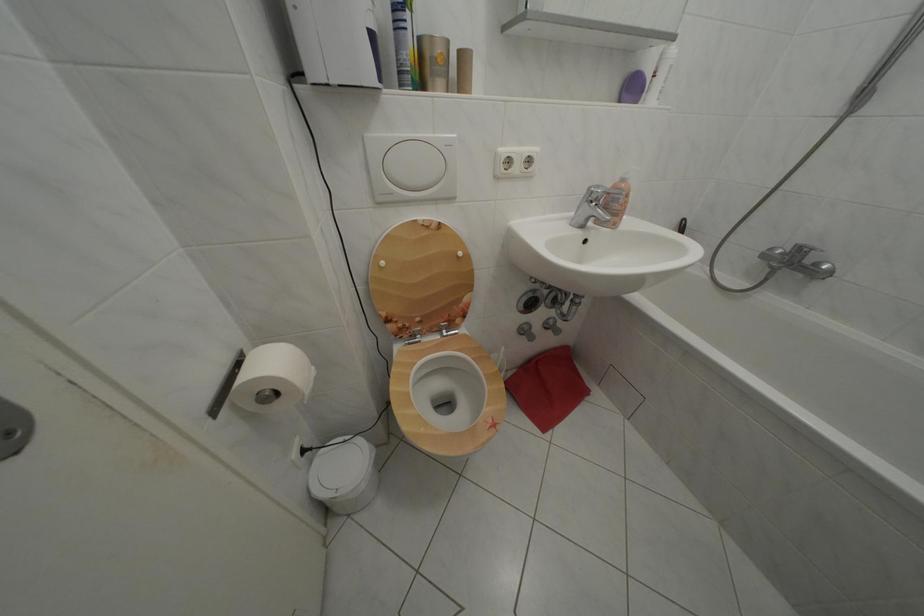
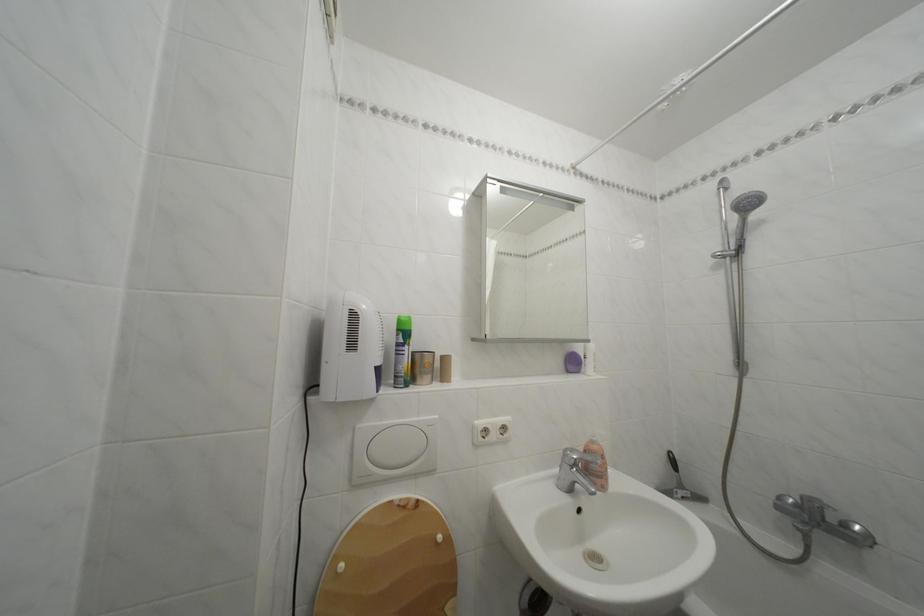
In the second image, find the point that corresponds to [605,228] in the first image.

(592, 492)